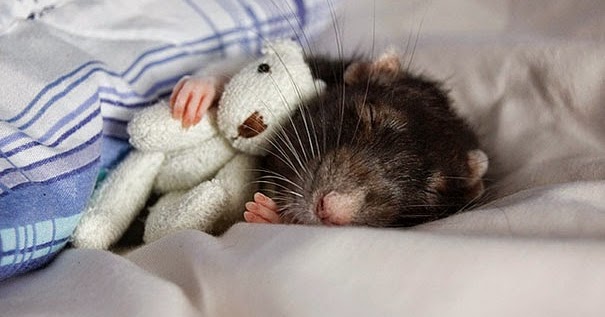
This screenshot has width=605, height=317. What are the coordinates of `doll` in the screenshot? It's located at (262, 100).